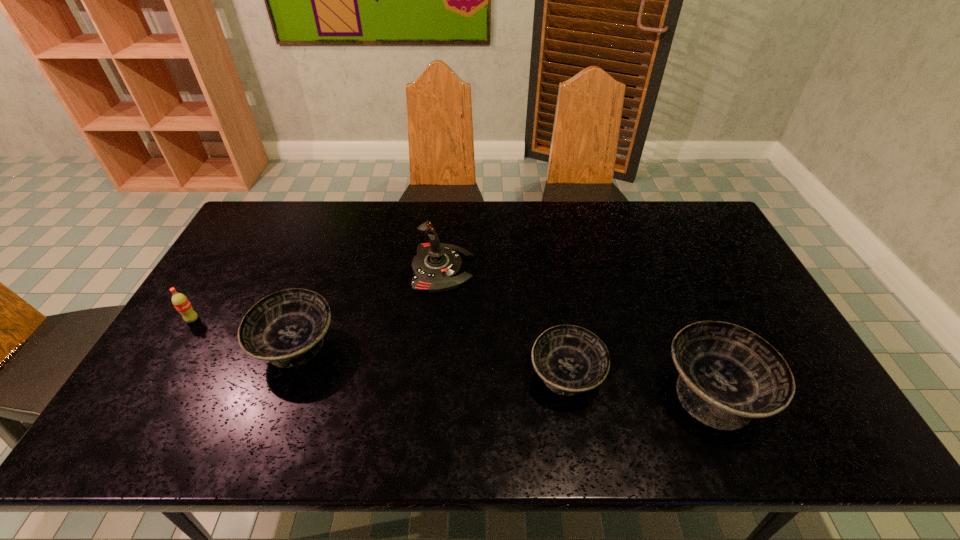
Identify the location of blank space located 0.140m on the back of the third object from right to left. (555, 308).

Image resolution: width=960 pixels, height=540 pixels. I want to click on vacant area located on the left of the rightmost bowl, so click(x=623, y=393).

Where is `vacant region located on the handle side of the third object from left to right`? vacant region located on the handle side of the third object from left to right is located at coordinates click(540, 268).

Locate an element on the screen. Image resolution: width=960 pixels, height=540 pixels. vacant space located on the right of the soda is located at coordinates (287, 320).

Where is `blank area located 0.070m on the front-facing side of the sunglasses`? This screenshot has width=960, height=540. blank area located 0.070m on the front-facing side of the sunglasses is located at coordinates (722, 319).

Image resolution: width=960 pixels, height=540 pixels. What are the coordinates of `object present at the left edge` in the screenshot? It's located at (180, 301).

Where is `bowl present at the right edge`? Image resolution: width=960 pixels, height=540 pixels. bowl present at the right edge is located at coordinates (728, 375).

Find the location of a particular element. This screenshot has width=960, height=540. sunglasses that is at the right edge is located at coordinates (699, 296).

Locate an element on the screen. object that is at the near right corner is located at coordinates (728, 375).

In the image, there is a desktop. At what (x,y) coordinates should I click in order to perform the action: click on vacant space at the far edge. Please return your answer as a coordinate pair (x, y). Image resolution: width=960 pixels, height=540 pixels. Looking at the image, I should click on (x=511, y=212).